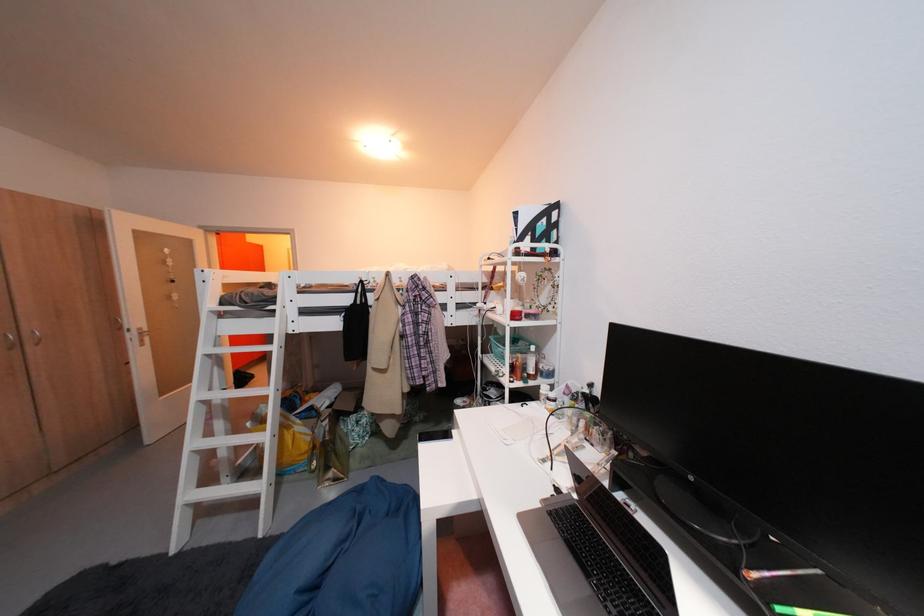
Locate an element on the screen. yellow paper bag is located at coordinates (286, 440).